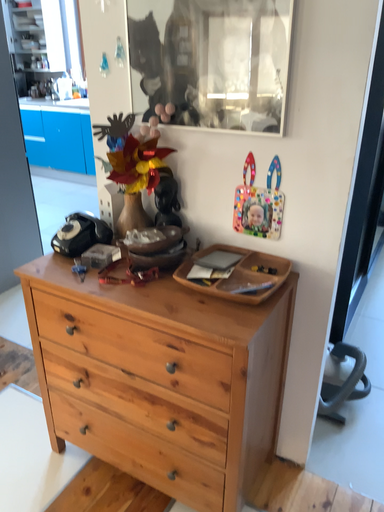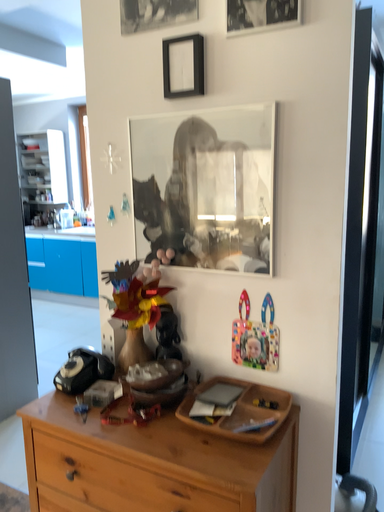
Question: Which way did the camera rotate in the video?

Choices:
 (A) rotated downward
 (B) rotated upward

Answer: (B)